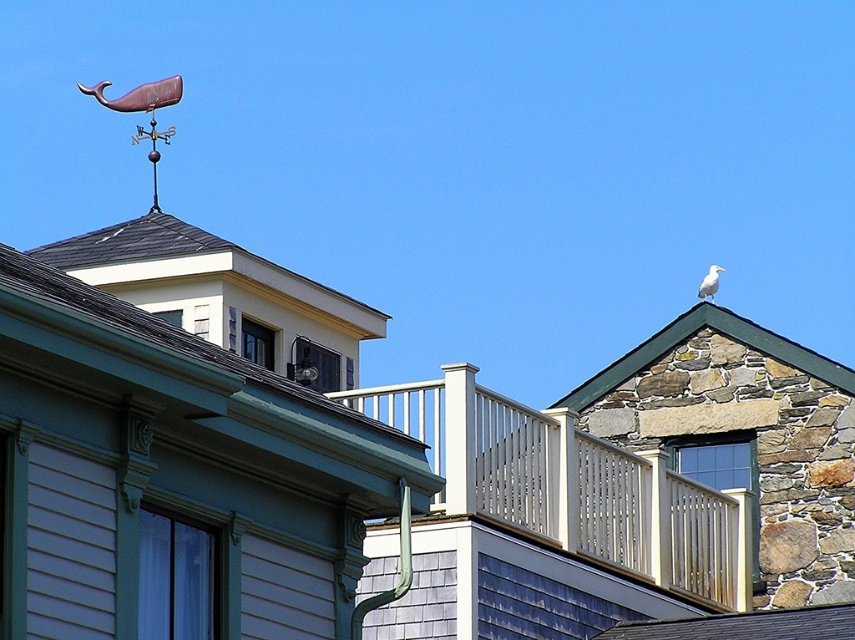
Which is behind, point (199, 240) or point (717, 284)?

Positioned behind is point (717, 284).

Can you confirm if white shingles at upper center is positioned below white feathered bird at upper right?

Actually, white shingles at upper center is above white feathered bird at upper right.

You are a GUI agent. You are given a task and a screenshot of the screen. Output one action in this format:
    pyautogui.click(x=<x>, y=<y>)
    Task: Click on the white shingles at upper center
    
    Given the screenshot: What is the action you would take?
    pyautogui.click(x=184, y=256)

Can you confirm if green shingles at upper center is positioned to the left of white feathered bird at upper right?

Correct, you'll find green shingles at upper center to the left of white feathered bird at upper right.

Who is more distant from viewer, (4, 264) or (706, 292)?

Positioned behind is point (706, 292).

Image resolution: width=855 pixels, height=640 pixels. Find the location of `green shingles at upper center`. green shingles at upper center is located at coordinates (167, 336).

Does white shingles at upper center appear on the right side of rusty metal whale at upper left?

Correct, you'll find white shingles at upper center to the right of rusty metal whale at upper left.

Is white shingles at upper center wider than rusty metal whale at upper left?

Yes, white shingles at upper center is wider than rusty metal whale at upper left.

Locate an element on the screen. The width and height of the screenshot is (855, 640). white shingles at upper center is located at coordinates (184, 256).

This screenshot has width=855, height=640. In order to click on white shingles at upper center in this screenshot , I will do `click(184, 256)`.